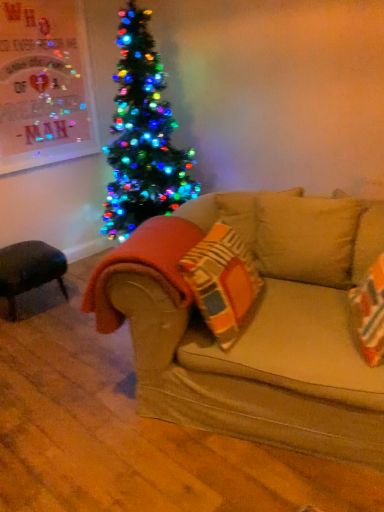
Question: From the image's perspective, is orange fuzzy blanket at lower left positioned above or below beige fabric couch at center?

Choices:
 (A) above
 (B) below

Answer: (A)

Question: Is orange fuzzy blanket at lower left situated inside beige fabric couch at center or outside?

Choices:
 (A) inside
 (B) outside

Answer: (B)

Question: Which is nearer to the black leather ottoman at lower left?

Choices:
 (A) beige fabric couch at center
 (B) orange fuzzy blanket at lower left

Answer: (B)

Question: Which object is the farthest from the beige fabric couch at center?

Choices:
 (A) orange fuzzy blanket at lower left
 (B) black leather ottoman at lower left

Answer: (B)